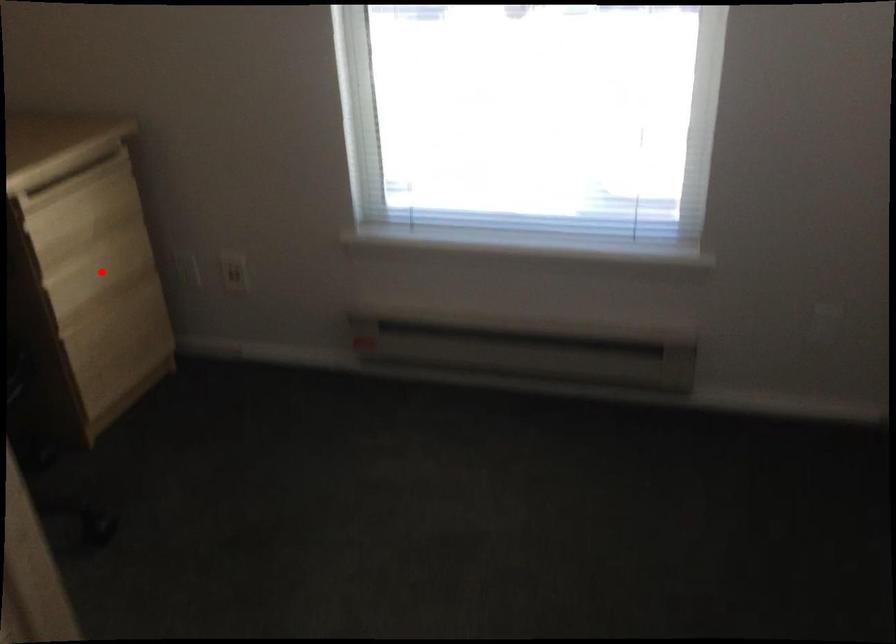
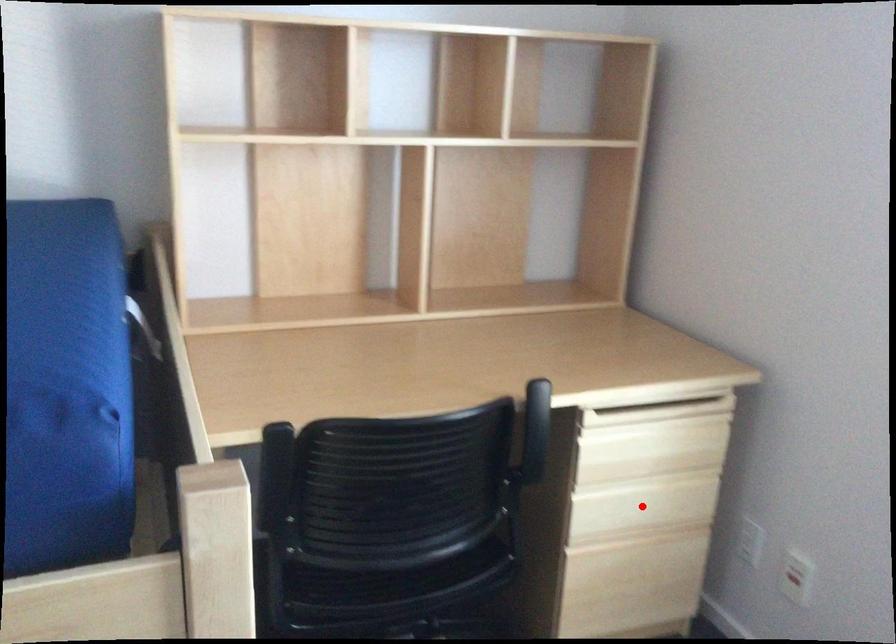
I am providing you with two images of the same scene from different viewpoints. A red point is marked on the first image and another point is marked on the second image. Does the point marked in image1 correspond to the same location as the one in image2?

Yes